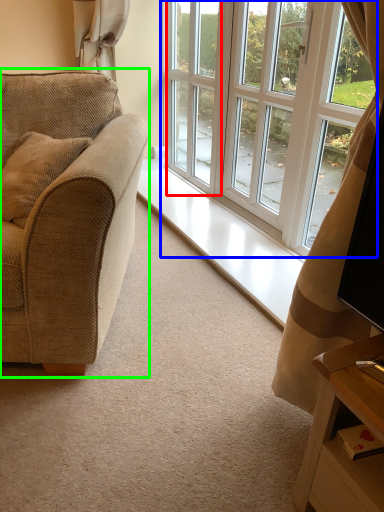
Question: Considering the real-world distances, which object is closest to screen door (highlighted by a red box)? window (highlighted by a blue box) or studio couch (highlighted by a green box).

Choices:
 (A) window
 (B) studio couch

Answer: (A)